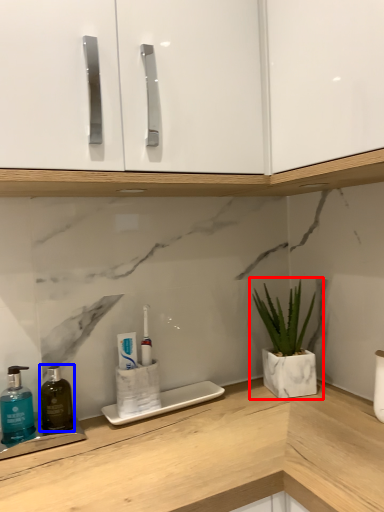
Question: Which object is further to the camera taking this photo, houseplant (highlighted by a red box) or mouthwash (highlighted by a blue box)?

Choices:
 (A) houseplant
 (B) mouthwash

Answer: (A)